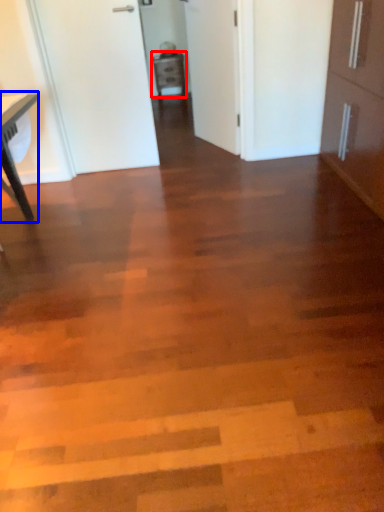
Question: Which object appears farthest to the camera in this image, cabinetry (highlighted by a red box) or table (highlighted by a blue box)?

Choices:
 (A) cabinetry
 (B) table

Answer: (A)